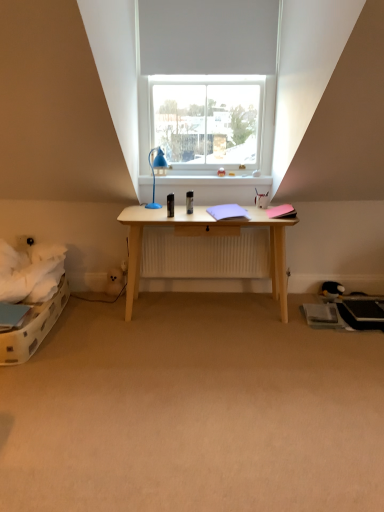
Question: Is the position of white matte window at upper center more distant than that of black plush toy at lower right?

Choices:
 (A) yes
 (B) no

Answer: (B)

Question: Would you say black plush toy at lower right is part of white matte window at upper center's contents?

Choices:
 (A) yes
 (B) no

Answer: (B)

Question: Considering the relative sizes of white matte window at upper center and black plush toy at lower right in the image provided, is white matte window at upper center bigger than black plush toy at lower right?

Choices:
 (A) yes
 (B) no

Answer: (A)

Question: From the image's perspective, is white matte window at upper center on top of black plush toy at lower right?

Choices:
 (A) no
 (B) yes

Answer: (B)

Question: Is white matte window at upper center aimed at black plush toy at lower right?

Choices:
 (A) no
 (B) yes

Answer: (A)

Question: Considering the relative sizes of white matte window at upper center and black plush toy at lower right in the image provided, is white matte window at upper center smaller than black plush toy at lower right?

Choices:
 (A) no
 (B) yes

Answer: (A)

Question: Is blue plastic lamp at center at the back of white glossy window sill at upper center?

Choices:
 (A) yes
 (B) no

Answer: (B)

Question: Can you confirm if white glossy window sill at upper center is wider than blue plastic lamp at center?

Choices:
 (A) yes
 (B) no

Answer: (B)

Question: From a real-world perspective, is white glossy window sill at upper center below blue plastic lamp at center?

Choices:
 (A) no
 (B) yes

Answer: (B)

Question: Can you confirm if white glossy window sill at upper center is taller than blue plastic lamp at center?

Choices:
 (A) yes
 (B) no

Answer: (B)

Question: From the image's perspective, is white glossy window sill at upper center below blue plastic lamp at center?

Choices:
 (A) no
 (B) yes

Answer: (A)

Question: Considering the relative sizes of white glossy window sill at upper center and blue plastic lamp at center in the image provided, is white glossy window sill at upper center bigger than blue plastic lamp at center?

Choices:
 (A) yes
 (B) no

Answer: (A)

Question: Is beige carpet at center closer to the viewer compared to black plush toy at lower right?

Choices:
 (A) yes
 (B) no

Answer: (A)